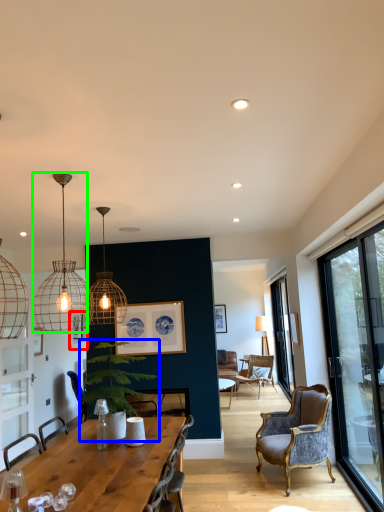
Question: Considering the real-world distances, which object is closest to picture frame (highlighted by a red box)? houseplant (highlighted by a blue box) or lamp (highlighted by a green box).

Choices:
 (A) houseplant
 (B) lamp

Answer: (B)